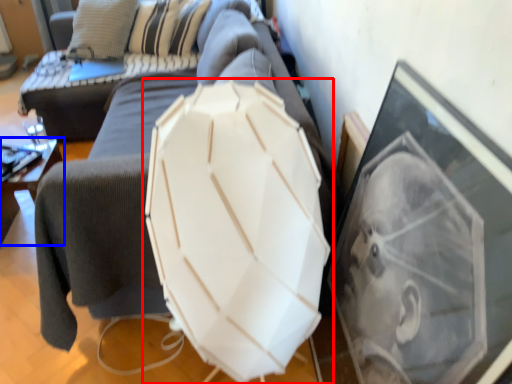
Question: Among these objects, which one is farthest to the camera, umbrella (highlighted by a red box) or furniture (highlighted by a blue box)?

Choices:
 (A) umbrella
 (B) furniture

Answer: (B)